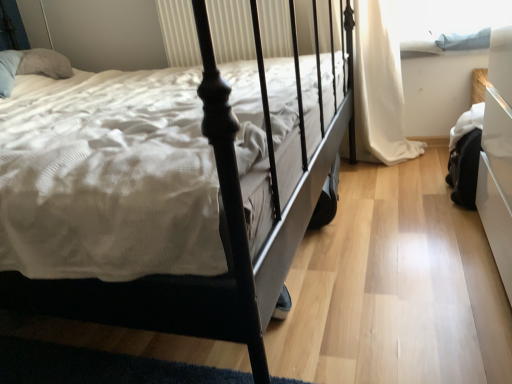
Question: Is white fabric curtain at right shorter than matte black bed at center?

Choices:
 (A) no
 (B) yes

Answer: (B)

Question: Does white fabric curtain at right have a greater height compared to matte black bed at center?

Choices:
 (A) no
 (B) yes

Answer: (A)

Question: Is the position of white fabric curtain at right less distant than that of matte black bed at center?

Choices:
 (A) no
 (B) yes

Answer: (A)

Question: Is white fabric curtain at right far away from matte black bed at center?

Choices:
 (A) yes
 (B) no

Answer: (B)

Question: Does white fabric curtain at right lie behind matte black bed at center?

Choices:
 (A) no
 (B) yes

Answer: (B)

Question: Is white fabric curtain at right outside matte black bed at center?

Choices:
 (A) no
 (B) yes

Answer: (B)

Question: Does blue fabric at upper right appear on the right side of white fabric curtain at right?

Choices:
 (A) yes
 (B) no

Answer: (A)

Question: From a real-world perspective, is blue fabric at upper right positioned over white fabric curtain at right based on gravity?

Choices:
 (A) no
 (B) yes

Answer: (B)

Question: Can you confirm if blue fabric at upper right is taller than white fabric curtain at right?

Choices:
 (A) yes
 (B) no

Answer: (B)

Question: Would you say white fabric curtain at right is part of blue fabric at upper right's contents?

Choices:
 (A) yes
 (B) no

Answer: (B)

Question: From the image's perspective, is blue fabric at upper right on top of white fabric curtain at right?

Choices:
 (A) no
 (B) yes

Answer: (B)

Question: Is blue fabric at upper right looking in the opposite direction of white fabric curtain at right?

Choices:
 (A) no
 (B) yes

Answer: (A)

Question: Does blue fabric at upper right come behind matte black bed at center?

Choices:
 (A) no
 (B) yes

Answer: (B)